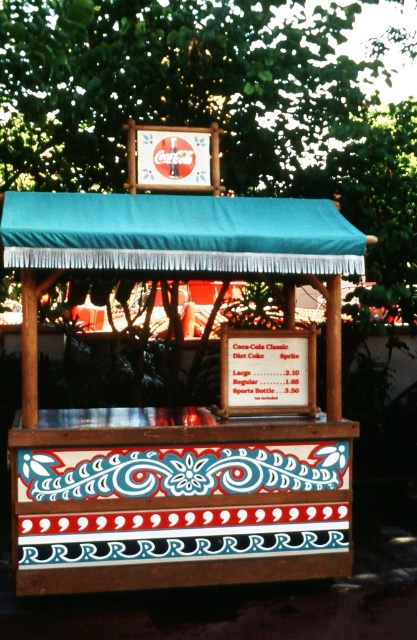
Who is positioned more to the left, wooden at center or teal fabric canopy at upper center?

Positioned to the left is teal fabric canopy at upper center.

Between point (301, 508) and point (68, 259), which one is positioned in front?

Point (68, 259) is more forward.

The width and height of the screenshot is (417, 640). In order to click on wooden at center in this screenshot , I will do `click(185, 406)`.